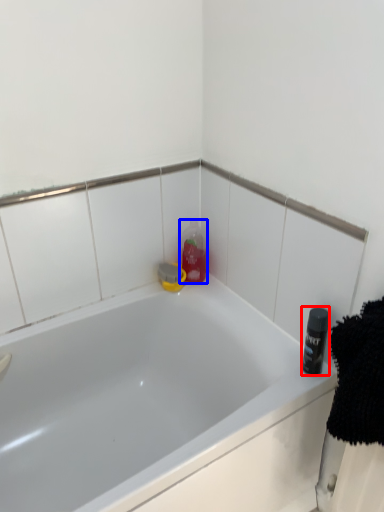
Question: Which object appears closest to the camera in this image, toiletry (highlighted by a red box) or cleaning product (highlighted by a blue box)?

Choices:
 (A) toiletry
 (B) cleaning product

Answer: (A)